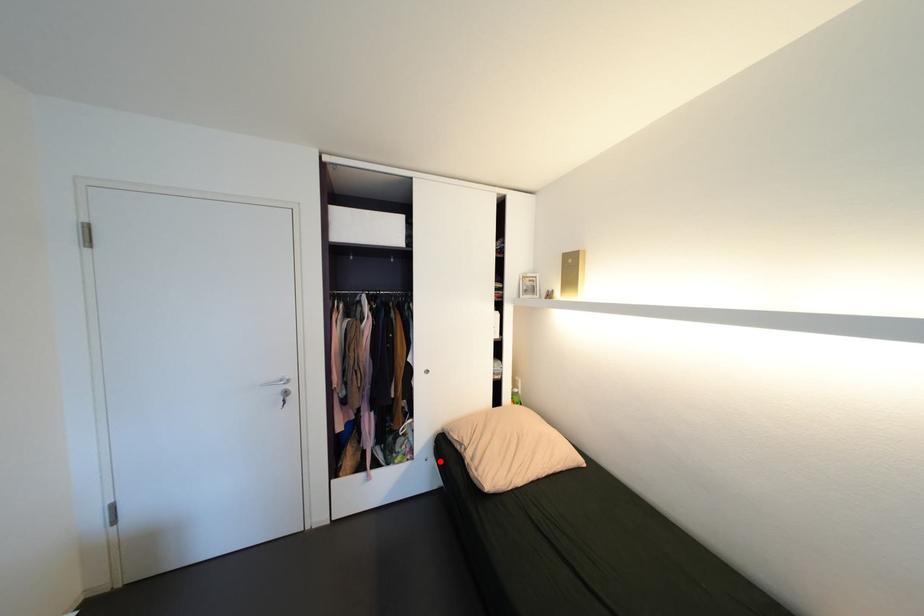
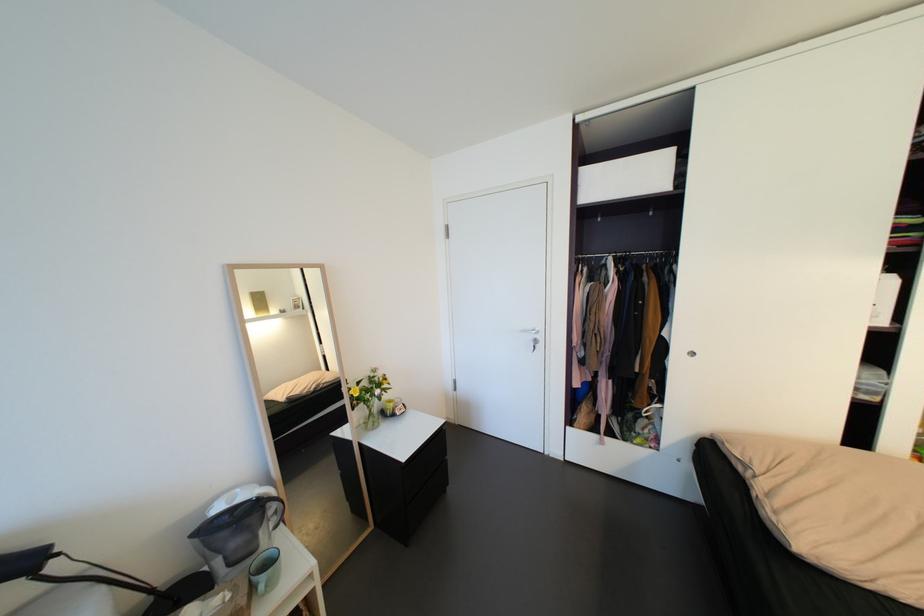
Locate, in the second image, the point that corresponds to the highlighted location in the first image.

(697, 467)